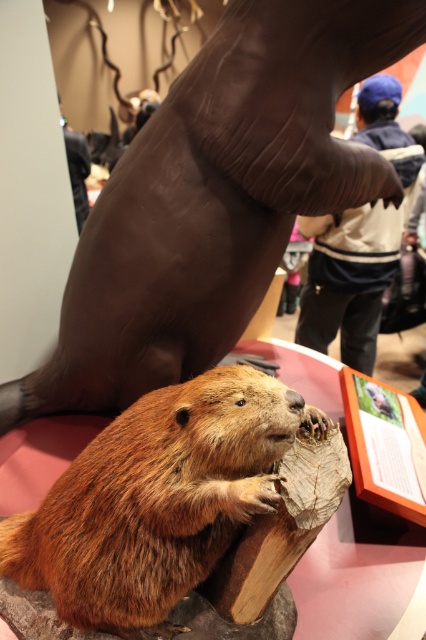
You are an observer looking at the diorama. You notice the brown furry beaver at center and the blue knit cap at upper center. Which object is wider?

The brown furry beaver at center is wider than the blue knit cap at upper center.

You are an observer looking at the diorama. You notice the brown furry beaver at center and the brown fur beaver at lower left. Which beaver is closer to you?

The brown furry beaver at center is closer to you because it is positioned under the brown fur beaver at lower left, indicating it is in front.

You are a child visiting a museum and see this diorama. You want to know which beaver is shorter. Which one is shorter between the brown furry beaver at center and the brown fur beaver at lower left?

The brown furry beaver at center is shorter than the brown fur beaver at lower left.